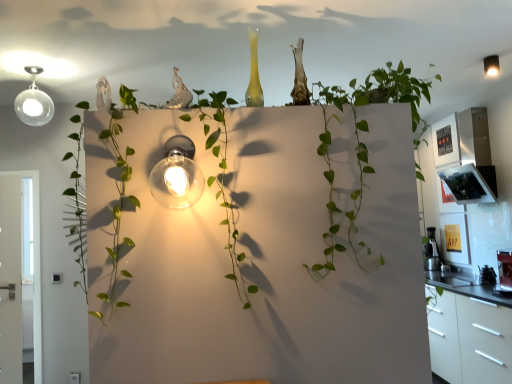
Describe the element at coordinates (469, 331) in the screenshot. This screenshot has height=384, width=512. I see `white glossy cabinet at right` at that location.

Image resolution: width=512 pixels, height=384 pixels. I want to click on clear glass light fixture at center, the 1th light fixture viewed from the left, so click(177, 175).

Are clear glass light fixture at center, placed as the second light fixture when sorted from right to left, and white glossy cabinet at right far apart?

That's right, there is a large distance between clear glass light fixture at center, placed as the second light fixture when sorted from right to left, and white glossy cabinet at right.

In the scene shown: Would you say clear glass light fixture at center, placed as the second light fixture when sorted from right to left, is to the left or to the right of white glossy cabinet at right in the picture?

In the image, clear glass light fixture at center, placed as the second light fixture when sorted from right to left, appears on the left side of white glossy cabinet at right.

Is clear glass light fixture at center, which appears as the 2th light fixture when viewed from the top, inside or outside of white glossy cabinet at right?

clear glass light fixture at center, which appears as the 2th light fixture when viewed from the top, lies outside white glossy cabinet at right.

How far apart are clear glass light fixture at center, which is the first light fixture in front-to-back order, and white glossy cabinet at right?

clear glass light fixture at center, which is the first light fixture in front-to-back order, and white glossy cabinet at right are 8.42 feet apart.

Measure the distance from clear glass light fixture at center, the 1th light fixture viewed from the left, to metallic silver coffee maker at right.

A distance of 3.11 meters exists between clear glass light fixture at center, the 1th light fixture viewed from the left, and metallic silver coffee maker at right.

From the image's perspective, is clear glass light fixture at center, the 1th light fixture viewed from the left, above or below metallic silver coffee maker at right?

Based on their image positions, clear glass light fixture at center, the 1th light fixture viewed from the left, is located above metallic silver coffee maker at right.

Is clear glass light fixture at center, the 1th light fixture viewed from the left, bigger than metallic silver coffee maker at right?

No.

From a real-world perspective, which is physically above, clear glass light fixture at center, the 1th light fixture viewed from the left, or metallic silver coffee maker at right?

From a 3D spatial view, clear glass light fixture at center, the 1th light fixture viewed from the left, is above.

At what (x,y) coordinates should I click in order to perform the action: click on dresser below the matte black light fixture at upper right, which is the first light fixture from back to front (from a real-world perspective). Please return your answer as a coordinate pair (x, y). This screenshot has height=384, width=512. Looking at the image, I should click on (469, 331).

Is matte black light fixture at upper right, which is counted as the second light fixture, starting from the bottom, thinner than white glossy cabinet at right?

Indeed, matte black light fixture at upper right, which is counted as the second light fixture, starting from the bottom, has a lesser width compared to white glossy cabinet at right.

Is matte black light fixture at upper right, marked as the 1th light fixture in a right-to-left arrangement, taller than white glossy cabinet at right?

No.

Which of these two, matte black light fixture at upper right, which is counted as the second light fixture, starting from the left, or white glossy cabinet at right, is smaller?

Smaller between the two is matte black light fixture at upper right, which is counted as the second light fixture, starting from the left.

From the image's perspective, which one is positioned lower, white glossy cabinet at right or matte black light fixture at upper right, which is the 2th light fixture in front-to-back order?

white glossy cabinet at right appears lower in the image.

Could matte black light fixture at upper right, which is the first light fixture from back to front, be considered to be inside white glossy cabinet at right?

Actually, matte black light fixture at upper right, which is the first light fixture from back to front, is outside white glossy cabinet at right.

Which of these two, white glossy cabinet at right or matte black light fixture at upper right, marked as the 1th light fixture in a right-to-left arrangement, is thinner?

With smaller width is matte black light fixture at upper right, marked as the 1th light fixture in a right-to-left arrangement.

Does point (492, 56) come behind point (157, 187)?

Yes, it is.

Does matte black light fixture at upper right, which is the first light fixture from back to front, have a greater height compared to clear glass light fixture at center, positioned as the second light fixture in back-to-front order?

In fact, matte black light fixture at upper right, which is the first light fixture from back to front, may be shorter than clear glass light fixture at center, positioned as the second light fixture in back-to-front order.

Is clear glass light fixture at center, which is the first light fixture in front-to-back order, located within matte black light fixture at upper right, which is counted as the second light fixture, starting from the left?

No.

How distant is matte black light fixture at upper right, marked as the 1th light fixture in a right-to-left arrangement, from clear glass light fixture at center, positioned as the second light fixture in back-to-front order?

matte black light fixture at upper right, marked as the 1th light fixture in a right-to-left arrangement, and clear glass light fixture at center, positioned as the second light fixture in back-to-front order, are 2.60 meters apart.

Is clear glass light fixture at center, placed as the second light fixture when sorted from right to left, in front of matte black light fixture at upper right, which is counted as the second light fixture, starting from the left?

Yes, clear glass light fixture at center, placed as the second light fixture when sorted from right to left, is closer to the camera.

Which of these two, clear glass light fixture at center, placed as the second light fixture when sorted from right to left, or matte black light fixture at upper right, which is the 2th light fixture in front-to-back order, is thinner?

matte black light fixture at upper right, which is the 2th light fixture in front-to-back order, is thinner.

Which of these two, clear glass light fixture at center, positioned as the second light fixture in back-to-front order, or matte black light fixture at upper right, which is the first light fixture from back to front, is smaller?

With smaller size is matte black light fixture at upper right, which is the first light fixture from back to front.

Is matte black light fixture at upper right, placed as the first light fixture when sorted from top to bottom, surrounded by clear glass light fixture at center, which is the first light fixture in front-to-back order?

No, matte black light fixture at upper right, placed as the first light fixture when sorted from top to bottom, is not surrounded by clear glass light fixture at center, which is the first light fixture in front-to-back order.

Is there a large distance between metallic silver coffee maker at right and white glossy cabinet at right?

That's not correct — metallic silver coffee maker at right is a little close to white glossy cabinet at right.

Which is more to the right, metallic silver coffee maker at right or white glossy cabinet at right?

metallic silver coffee maker at right.

Looking at this image, which object is more forward, metallic silver coffee maker at right or white glossy cabinet at right?

white glossy cabinet at right.

Locate an element on the screen. dresser behind the clear glass light fixture at center, placed as the second light fixture when sorted from right to left is located at coordinates (469, 331).

In order to click on appliance below the clear glass light fixture at center, placed as the second light fixture when sorted from right to left (from a real-world perspective) in this screenshot , I will do `click(432, 251)`.

Which object lies further to the anchor point white glossy cabinet at right, clear glass light fixture at center, the 1th light fixture from the bottom, or metallic silver coffee maker at right?

Among the two, clear glass light fixture at center, the 1th light fixture from the bottom, is located further to white glossy cabinet at right.

From the image, which object appears to be farther from white glossy cabinet at right, matte black light fixture at upper right, which is counted as the second light fixture, starting from the bottom, or metallic silver coffee maker at right?

matte black light fixture at upper right, which is counted as the second light fixture, starting from the bottom, is further to white glossy cabinet at right.

Looking at the image, which one is located further to white glossy cabinet at right, metallic silver coffee maker at right or clear glass light fixture at center, which is the first light fixture in front-to-back order?

clear glass light fixture at center, which is the first light fixture in front-to-back order, is positioned further to the anchor white glossy cabinet at right.

Considering their positions, is clear glass light fixture at center, positioned as the second light fixture in back-to-front order, positioned further to white glossy cabinet at right than matte black light fixture at upper right, placed as the first light fixture when sorted from top to bottom?

clear glass light fixture at center, positioned as the second light fixture in back-to-front order, lies further to white glossy cabinet at right than the other object.

Based on their spatial positions, is white glossy cabinet at right or matte black light fixture at upper right, which is the 2th light fixture in front-to-back order, closer to clear glass light fixture at center, the 1th light fixture viewed from the left?

Among the two, white glossy cabinet at right is located nearer to clear glass light fixture at center, the 1th light fixture viewed from the left.

From the image, which object appears to be farther from clear glass light fixture at center, placed as the second light fixture when sorted from right to left, white glossy cabinet at right or metallic silver coffee maker at right?

metallic silver coffee maker at right is positioned further to the anchor clear glass light fixture at center, placed as the second light fixture when sorted from right to left.

Considering their positions, is matte black light fixture at upper right, placed as the first light fixture when sorted from top to bottom, positioned closer to metallic silver coffee maker at right than white glossy cabinet at right?

white glossy cabinet at right.

Considering their positions, is matte black light fixture at upper right, placed as the first light fixture when sorted from top to bottom, positioned further to clear glass light fixture at center, which appears as the 2th light fixture when viewed from the top, than metallic silver coffee maker at right?

Among the two, metallic silver coffee maker at right is located further to clear glass light fixture at center, which appears as the 2th light fixture when viewed from the top.

Identify the location of appliance between matte black light fixture at upper right, which is counted as the second light fixture, starting from the bottom, and white glossy cabinet at right, in the vertical direction. The height and width of the screenshot is (384, 512). (432, 251).

Where is `dresser located between clear glass light fixture at center, positioned as the second light fixture in back-to-front order, and metallic silver coffee maker at right in the depth direction`? dresser located between clear glass light fixture at center, positioned as the second light fixture in back-to-front order, and metallic silver coffee maker at right in the depth direction is located at coordinates (469, 331).

The height and width of the screenshot is (384, 512). I want to click on light fixture situated between clear glass light fixture at center, the 1th light fixture from the bottom, and white glossy cabinet at right from left to right, so click(x=490, y=65).

The height and width of the screenshot is (384, 512). I want to click on light fixture positioned between clear glass light fixture at center, placed as the second light fixture when sorted from right to left, and metallic silver coffee maker at right from near to far, so click(x=490, y=65).